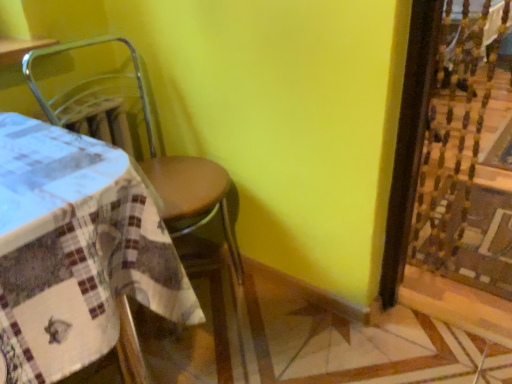
What do you see at coordinates (154, 154) in the screenshot?
I see `metallic brown stool at upper left` at bounding box center [154, 154].

At what (x,y) coordinates should I click in order to perform the action: click on metallic brown stool at upper left. Please return your answer as a coordinate pair (x, y). The image size is (512, 384). Looking at the image, I should click on (154, 154).

Where is `metallic brown stool at upper left`? The image size is (512, 384). metallic brown stool at upper left is located at coordinates (154, 154).